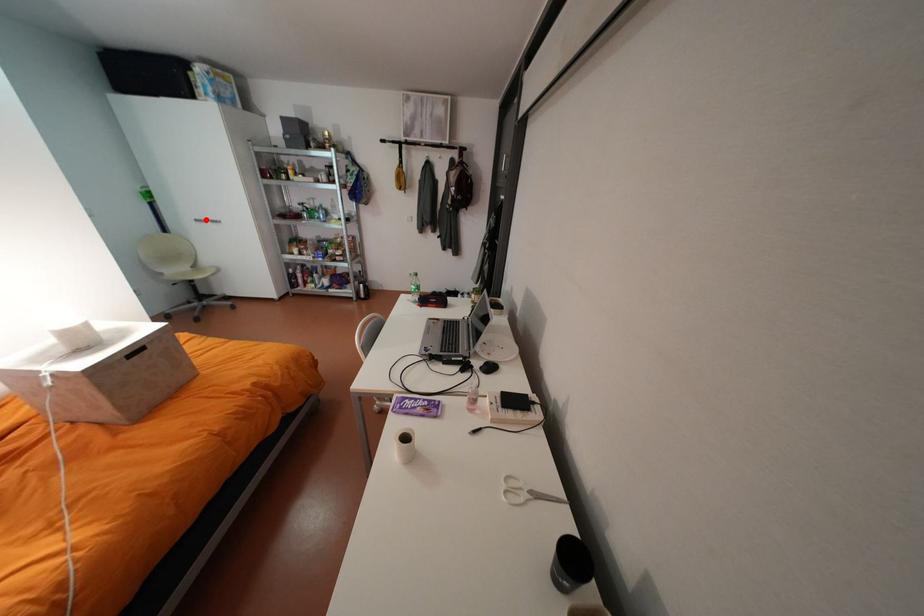
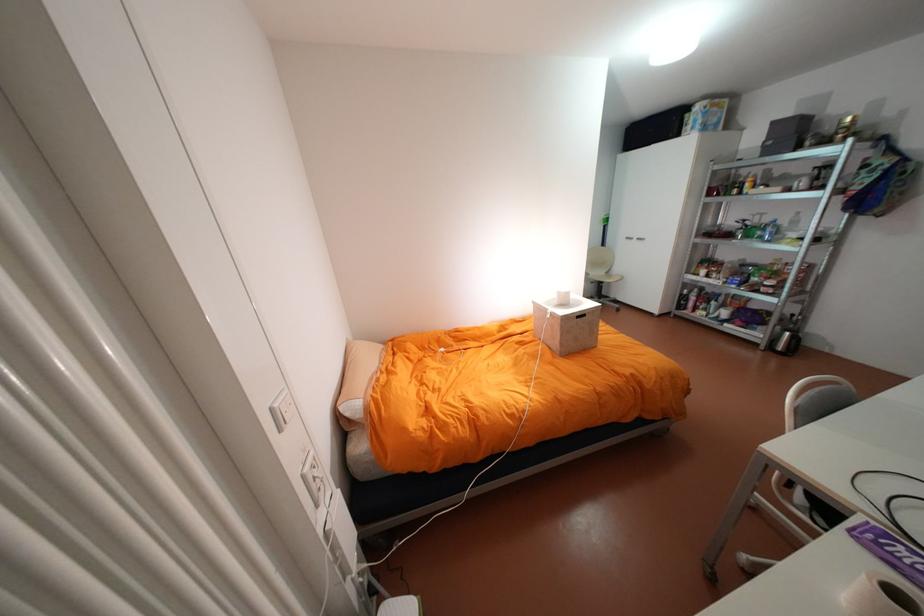
Question: I am providing you with two images of the same scene from different viewpoints. Given a red point in image1, look at the same physical point in image2. Is it:

Choices:
 (A) Closer to the viewpoint
 (B) Farther from the viewpoint

Answer: (A)